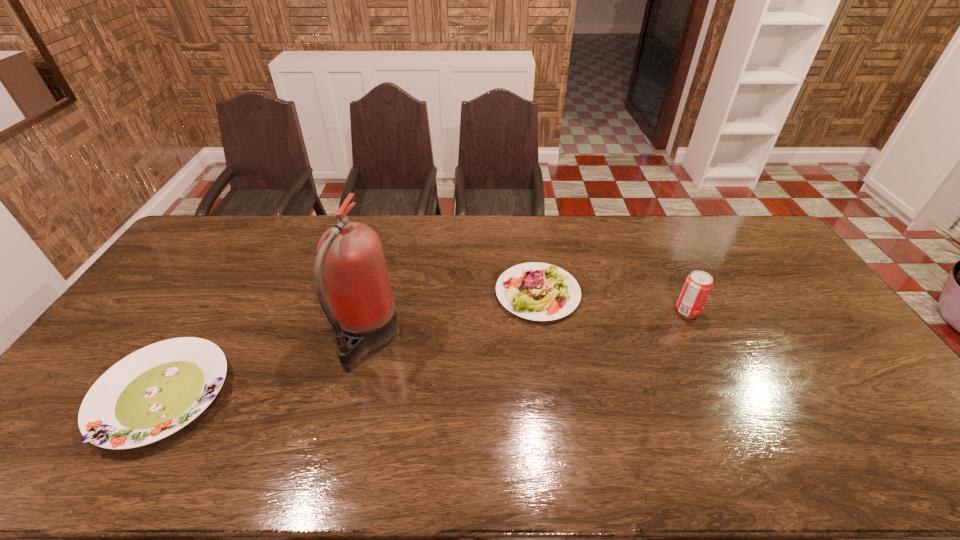
The width and height of the screenshot is (960, 540). I want to click on free region located 0.060m on the right of the right salad plate, so [x=598, y=293].

The image size is (960, 540). Find the location of `vacant space located 0.300m on the back of the left salad plate`. vacant space located 0.300m on the back of the left salad plate is located at coordinates (237, 275).

At what (x,y) coordinates should I click in order to perform the action: click on object positioned at the near edge. Please return your answer as a coordinate pair (x, y). The image size is (960, 540). Looking at the image, I should click on (157, 390).

Identify the location of object that is at the left edge. The width and height of the screenshot is (960, 540). (157, 390).

I want to click on object that is positioned at the near left corner, so click(x=157, y=390).

You are a GUI agent. You are given a task and a screenshot of the screen. Output one action in this format:
    pyautogui.click(x=<x>, y=<y>)
    Task: Click on the vacant space at the far edge of the desktop
    This screenshot has height=540, width=960.
    Given the screenshot: What is the action you would take?
    pyautogui.click(x=420, y=252)

Where is `free space at the near edge of the desktop`? The image size is (960, 540). free space at the near edge of the desktop is located at coordinates (100, 458).

The height and width of the screenshot is (540, 960). Identify the location of vacant region at the right edge of the desktop. (844, 373).

This screenshot has height=540, width=960. Identify the location of vacant space at the far left corner of the desktop. pos(196,234).

Where is `blank region between the fire extinguisher and the farther salad plate`? This screenshot has width=960, height=540. blank region between the fire extinguisher and the farther salad plate is located at coordinates (452, 316).